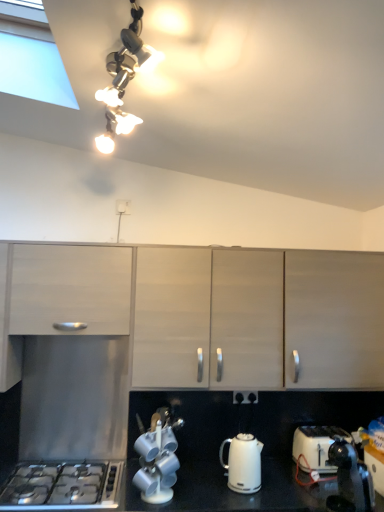
Question: Is white glossy electric kettle at lower center turned away from matte wood cabinet at left, which is counted as the first cabinetry, starting from the left?

Choices:
 (A) yes
 (B) no

Answer: (B)

Question: Is white glossy electric kettle at lower center positioned in front of matte wood cabinet at left, which is counted as the first cabinetry, starting from the left?

Choices:
 (A) no
 (B) yes

Answer: (B)

Question: Is white glossy electric kettle at lower center in contact with matte wood cabinet at left, which is the 2th cabinetry in right-to-left order?

Choices:
 (A) yes
 (B) no

Answer: (B)

Question: Is white glossy electric kettle at lower center surrounding matte wood cabinet at left, which is the 2th cabinetry in right-to-left order?

Choices:
 (A) no
 (B) yes

Answer: (A)

Question: From a real-world perspective, is white glossy electric kettle at lower center located beneath matte wood cabinet at left, which is counted as the first cabinetry, starting from the left?

Choices:
 (A) yes
 (B) no

Answer: (A)

Question: Considering the positions of point (127, 205) and point (115, 474), is point (127, 205) closer or farther from the camera than point (115, 474)?

Choices:
 (A) closer
 (B) farther

Answer: (B)

Question: In the image, is white plastic electric outlet at center, the second electric outlet viewed from the right, on the left side or the right side of stainless steel gas stove at lower left?

Choices:
 (A) right
 (B) left

Answer: (A)

Question: Is white plastic electric outlet at center, placed as the second electric outlet when sorted from bottom to top, taller or shorter than stainless steel gas stove at lower left?

Choices:
 (A) tall
 (B) short

Answer: (A)

Question: From a real-world perspective, is white plastic electric outlet at center, placed as the second electric outlet when sorted from bottom to top, physically located above or below stainless steel gas stove at lower left?

Choices:
 (A) above
 (B) below

Answer: (A)

Question: Considering the positions of point (117, 202) and point (170, 478), is point (117, 202) closer or farther from the camera than point (170, 478)?

Choices:
 (A) farther
 (B) closer

Answer: (A)

Question: Considering the relative positions of white plastic electric outlet at center, placed as the second electric outlet when sorted from bottom to top, and metallic silver tea set at lower center in the image provided, is white plastic electric outlet at center, placed as the second electric outlet when sorted from bottom to top, to the left or to the right of metallic silver tea set at lower center?

Choices:
 (A) left
 (B) right

Answer: (A)

Question: Based on their sizes in the image, would you say white plastic electric outlet at center, the second electric outlet viewed from the right, is bigger or smaller than metallic silver tea set at lower center?

Choices:
 (A) big
 (B) small

Answer: (B)

Question: From a real-world perspective, is white plastic electric outlet at center, which is the first electric outlet from top to bottom, physically located above or below metallic silver tea set at lower center?

Choices:
 (A) above
 (B) below

Answer: (A)

Question: Which is correct: matte wood cabinets at center, placed as the 1th cabinetry when sorted from right to left, is inside white glossy electric kettle at lower center, or outside of it?

Choices:
 (A) inside
 (B) outside

Answer: (B)

Question: From a real-world perspective, is matte wood cabinets at center, placed as the 1th cabinetry when sorted from right to left, above or below white glossy electric kettle at lower center?

Choices:
 (A) below
 (B) above

Answer: (B)